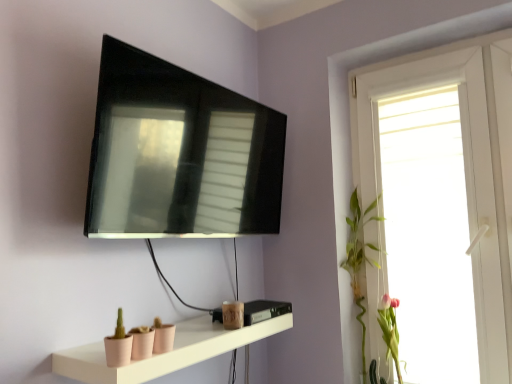
Question: Should I look upward or downward to see matte black tv at upper center?

Choices:
 (A) down
 (B) up

Answer: (B)

Question: Is pink matte flower at right, positioned as the 1th plant in right-to-left order, to the left of matte black tv at upper center from the viewer's perspective?

Choices:
 (A) no
 (B) yes

Answer: (A)

Question: Does pink matte flower at right, positioned as the 1th plant in right-to-left order, have a lesser width compared to matte black tv at upper center?

Choices:
 (A) yes
 (B) no

Answer: (B)

Question: Does pink matte flower at right, positioned as the 1th plant in right-to-left order, have a larger size compared to matte black tv at upper center?

Choices:
 (A) no
 (B) yes

Answer: (A)

Question: Is pink matte flower at right, positioned as the second plant in left-to-right order, surrounding matte black tv at upper center?

Choices:
 (A) yes
 (B) no

Answer: (B)

Question: From the image's perspective, does pink matte flower at right, positioned as the second plant in left-to-right order, appear higher than matte black tv at upper center?

Choices:
 (A) yes
 (B) no

Answer: (B)

Question: Does pink matte flower at right, positioned as the 1th plant in right-to-left order, lie in front of matte black tv at upper center?

Choices:
 (A) yes
 (B) no

Answer: (B)

Question: Does green leafy plant at right, the 1th plant viewed from the left, contain matte black tv at upper center?

Choices:
 (A) no
 (B) yes

Answer: (A)

Question: From a real-world perspective, does green leafy plant at right, the 1th plant viewed from the left, sit lower than matte black tv at upper center?

Choices:
 (A) no
 (B) yes

Answer: (B)

Question: Can you confirm if green leafy plant at right, which is the second plant from right to left, is shorter than matte black tv at upper center?

Choices:
 (A) yes
 (B) no

Answer: (B)

Question: Is green leafy plant at right, the 1th plant viewed from the left, at the right side of matte black tv at upper center?

Choices:
 (A) no
 (B) yes

Answer: (B)

Question: From a real-world perspective, is green leafy plant at right, which is the second plant from right to left, physically above matte black tv at upper center?

Choices:
 (A) yes
 (B) no

Answer: (B)

Question: Would you say green leafy plant at right, the 1th plant viewed from the left, is outside matte black tv at upper center?

Choices:
 (A) no
 (B) yes

Answer: (B)

Question: Is matte pink shelf at lower center shorter than white glossy window at upper right?

Choices:
 (A) no
 (B) yes

Answer: (B)